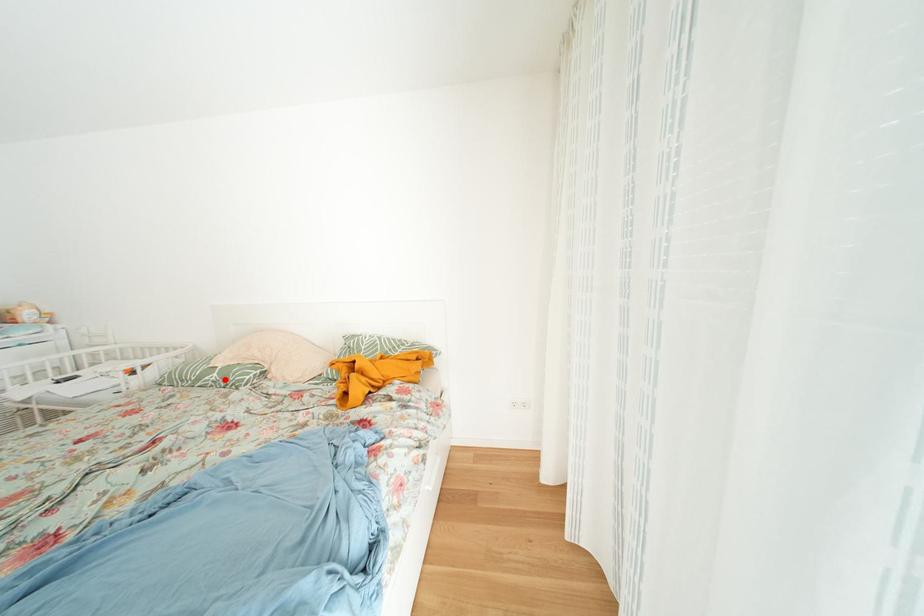
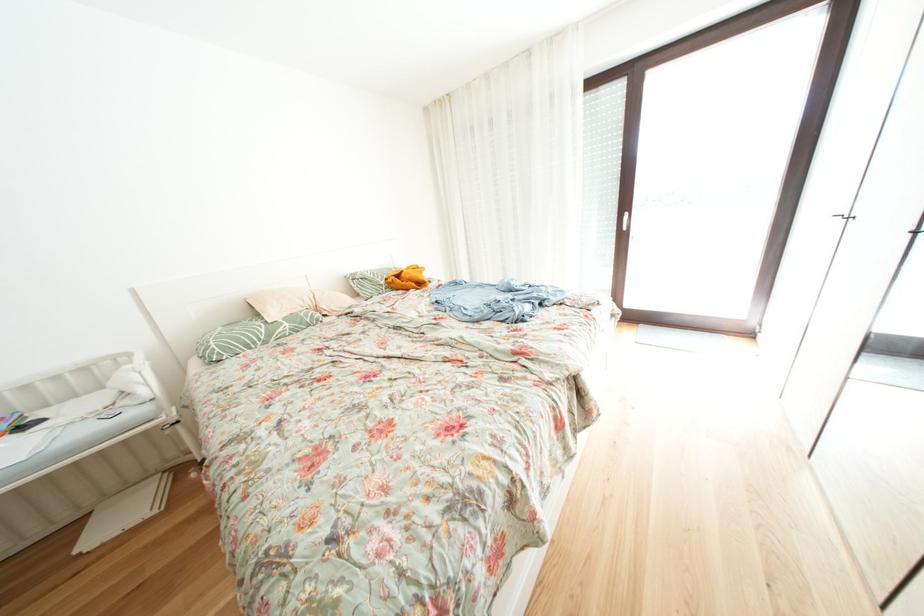
Where in the second image is the point corresponding to the highlighted location from the first image?

(296, 329)